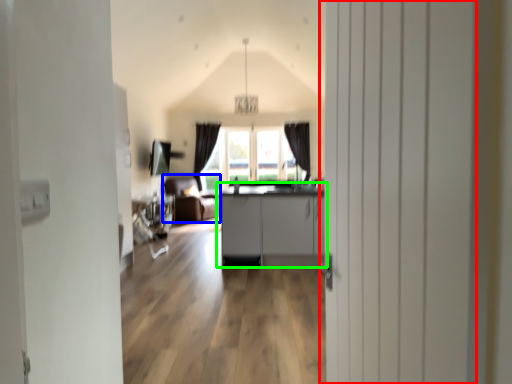
Question: Which object is the closest to the door (highlighted by a red box)? Choose among these: armchair (highlighted by a blue box) or cabinetry (highlighted by a green box).

Choices:
 (A) armchair
 (B) cabinetry

Answer: (B)